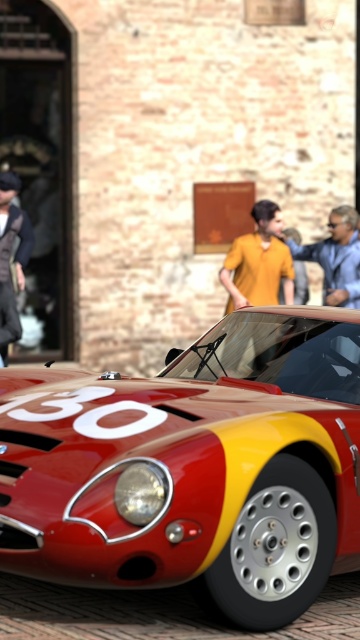
From the picture: Does shiny red and yellow sports car at center appear under matte yellow shirt at center?

Yes, shiny red and yellow sports car at center is below matte yellow shirt at center.

Who is shorter, shiny red and yellow sports car at center or matte yellow shirt at center?

Standing shorter between the two is shiny red and yellow sports car at center.

Where is `shiny red and yellow sports car at center`? This screenshot has height=640, width=360. shiny red and yellow sports car at center is located at coordinates (192, 467).

The width and height of the screenshot is (360, 640). In order to click on shiny red and yellow sports car at center in this screenshot , I will do pos(192,467).

Identify the location of yellow matte shirt at center. (258, 262).

I want to click on yellow matte shirt at center, so click(258, 262).

Is shiny red and yellow sports car at center bigger than yellow matte shirt at center?

Correct, shiny red and yellow sports car at center is larger in size than yellow matte shirt at center.

Which of these two, shiny red and yellow sports car at center or yellow matte shirt at center, stands taller?

With more height is yellow matte shirt at center.

Image resolution: width=360 pixels, height=640 pixels. What do you see at coordinates (192, 467) in the screenshot? I see `shiny red and yellow sports car at center` at bounding box center [192, 467].

Locate an element on the screen. shiny red and yellow sports car at center is located at coordinates (192, 467).